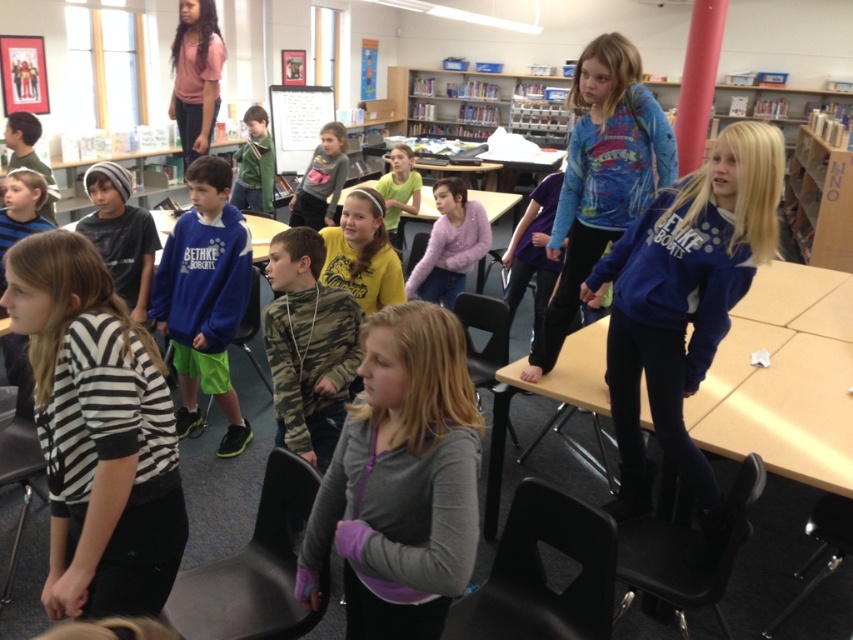
Question: Is black and white striped sweater at lower left to the left of pink t-shirt at upper left from the viewer's perspective?

Choices:
 (A) no
 (B) yes

Answer: (A)

Question: Is camo fabric shirt at center positioned before matte yellow shirt at center?

Choices:
 (A) yes
 (B) no

Answer: (A)

Question: Which object is farther from the camera taking this photo?

Choices:
 (A) yellow matte shirt at center
 (B) blue fleece hoodie at center

Answer: (B)

Question: Among these points, which one is farthest from the camera?

Choices:
 (A) (270, 189)
 (B) (395, 196)
 (C) (308, 454)

Answer: (A)

Question: Is camo fabric shirt at center to the right of fuzzy pink sweater at center from the viewer's perspective?

Choices:
 (A) yes
 (B) no

Answer: (B)

Question: Which of the following is the closest to the observer?

Choices:
 (A) (190, 42)
 (B) (450, 572)
 (C) (685, 365)

Answer: (B)